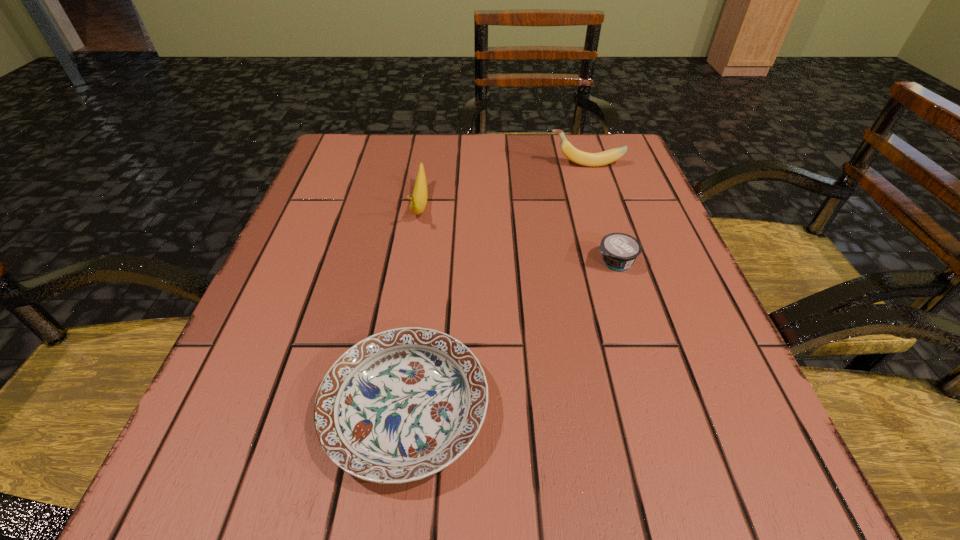
Locate an element on the screen. the farthest object is located at coordinates (577, 156).

Where is `the farther banana`? the farther banana is located at coordinates (577, 156).

You are a GUI agent. You are given a task and a screenshot of the screen. Output one action in this format:
    pyautogui.click(x=<x>, y=<y>)
    Task: Click on the nearer banana
    This screenshot has height=540, width=960.
    Given the screenshot: What is the action you would take?
    pyautogui.click(x=419, y=198)

Locate an element on the screen. The image size is (960, 540). the third nearest object is located at coordinates (419, 198).

Where is `yogurt`? yogurt is located at coordinates (619, 251).

Locate an element on the screen. the nearest object is located at coordinates (400, 405).

Where is `vacant region located 0.250m at the stem of the farther banana`? The height and width of the screenshot is (540, 960). vacant region located 0.250m at the stem of the farther banana is located at coordinates (443, 165).

The width and height of the screenshot is (960, 540). I want to click on free space located 0.340m at the stem of the farther banana, so pyautogui.click(x=405, y=165).

Locate an element on the screen. This screenshot has width=960, height=540. vacant space situated at the stem of the farther banana is located at coordinates (468, 165).

Find the location of a particular element. Image resolution: width=960 pixels, height=540 pixels. free space located at the stem of the nearer banana is located at coordinates (396, 349).